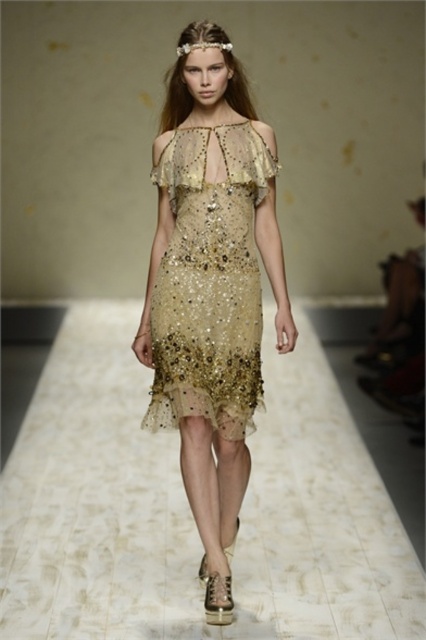
Between gold sequined dress at center and shimmering sequined dress at center, which one has less height?

A: shimmering sequined dress at center is shorter.

Where is `gold sequined dress at center`? gold sequined dress at center is located at coordinates (210, 285).